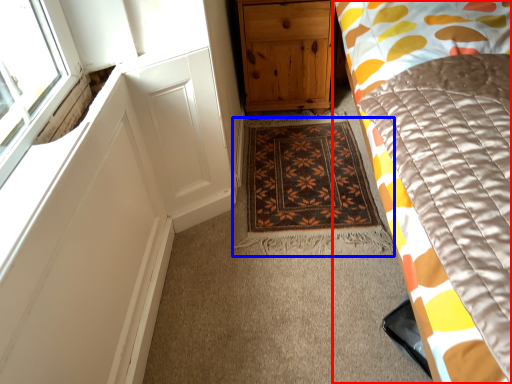
Question: Which object is further to the camera taking this photo, bed (highlighted by a red box) or mat (highlighted by a blue box)?

Choices:
 (A) bed
 (B) mat

Answer: (B)